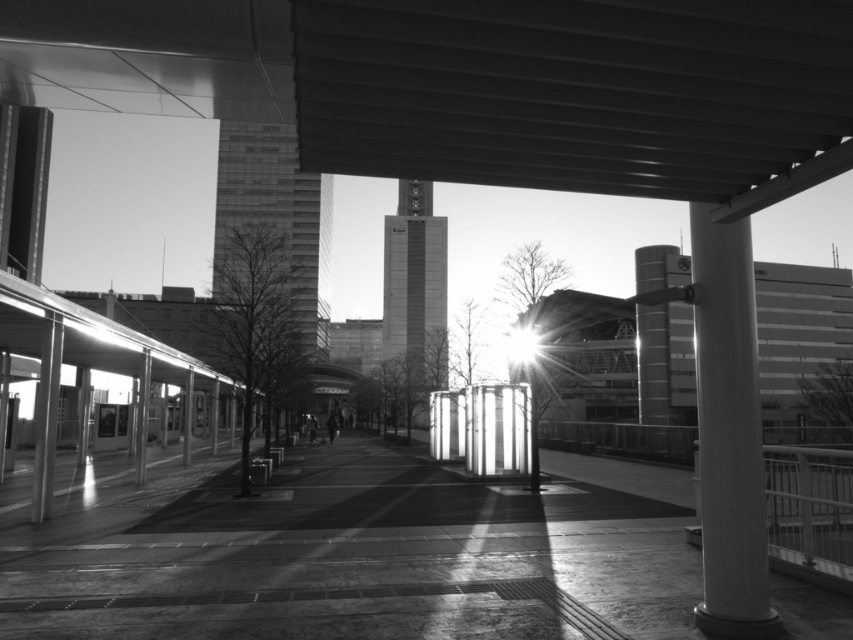
You are standing at the edge of the walkway and want to determine the relative positions of two points in the scene. Which of the two points, point (491,58) or point (648,637), is closer to your current position?

Point (491,58) is closer to the viewer than point (648,637), so it is closer to your current position.

You are an architect evaluating the structural integrity of the walkway. You notice the metallic roof at upper center and the smooth white column at right. Which object is shorter in height?

The metallic roof at upper center is not as tall as the smooth white column at right, so the metallic roof at upper center is shorter in height.